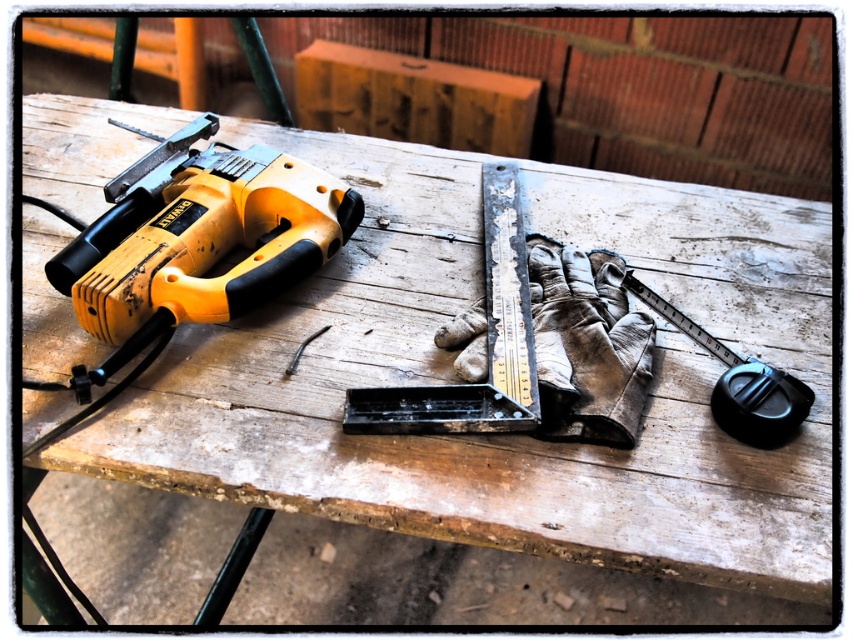
Question: Can you confirm if yellow matte/black grip drill at left is wider than black rubber tape measure at right?

Choices:
 (A) yes
 (B) no

Answer: (A)

Question: Which is nearer to the black rubber tape measure at right?

Choices:
 (A) wooden box at upper center
 (B) yellow matte/black grip drill at left

Answer: (A)

Question: Can you confirm if wooden box at upper center is bigger than black rubber tape measure at right?

Choices:
 (A) yes
 (B) no

Answer: (B)

Question: Is the position of yellow matte/black grip drill at left less distant than that of wooden box at upper center?

Choices:
 (A) yes
 (B) no

Answer: (A)

Question: Which of these objects is positioned farthest from the wooden box at upper center?

Choices:
 (A) black rubber tape measure at right
 (B) yellow matte/black grip drill at left

Answer: (A)

Question: Which of the following is the closest to the observer?

Choices:
 (A) (323, 108)
 (B) (170, 234)

Answer: (B)